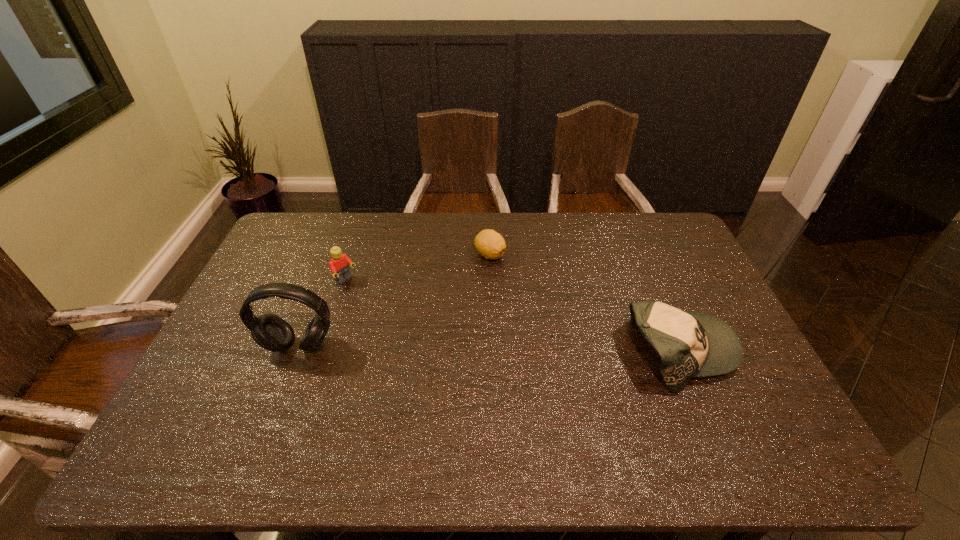
At what (x,y) coordinates should I click in order to perform the action: click on free space that is in between the headset and the rightmost object. Please return your answer as a coordinate pair (x, y). Looking at the image, I should click on click(490, 349).

Find the location of a particular element. This screenshot has width=960, height=540. vacant region between the Lego and the third object from left to right is located at coordinates coord(418,268).

You are a GUI agent. You are given a task and a screenshot of the screen. Output one action in this format:
    pyautogui.click(x=<x>, y=<y>)
    Task: Click on the vacant area that lies between the baseball cap and the headset
    The width and height of the screenshot is (960, 540).
    Given the screenshot: What is the action you would take?
    pyautogui.click(x=490, y=349)

Select which object is the second closest to the baseball cap. Please provide its 2D coordinates. Your answer should be formatted as a tuple, i.e. [(x, y)], where the tuple contains the x and y coordinates of a point satisfying the conditions above.

[(271, 332)]

Choose which object is the third nearest neighbor to the headset. Please provide its 2D coordinates. Your answer should be formatted as a tuple, i.e. [(x, y)], where the tuple contains the x and y coordinates of a point satisfying the conditions above.

[(690, 344)]

The width and height of the screenshot is (960, 540). Identify the location of free region that satisfies the following two spatial constraints: 1. on the front side of the rightmost object; 2. on the front-facing side of the third object from left to right. (492, 352).

Locate an element on the screen. The image size is (960, 540). free spot that satisfies the following two spatial constraints: 1. on the front side of the second object from right to left; 2. on the front-facing side of the baseball cap is located at coordinates (492, 352).

Where is `vacant space that satisfies the following two spatial constraints: 1. on the earcups of the baseball cap; 2. on the front-facing side of the tallest object`? vacant space that satisfies the following two spatial constraints: 1. on the earcups of the baseball cap; 2. on the front-facing side of the tallest object is located at coordinates (297, 352).

This screenshot has width=960, height=540. What are the coordinates of `free space that satisfies the following two spatial constraints: 1. on the earcups of the baseball cap; 2. on the front-facing side of the headset` in the screenshot? It's located at (297, 352).

You are a GUI agent. You are given a task and a screenshot of the screen. Output one action in this format:
    pyautogui.click(x=<x>, y=<y>)
    Task: Click on the vacant space that satisfies the following two spatial constraints: 1. on the earcups of the rightmost object; 2. on the front-facing side of the headset
    This screenshot has height=540, width=960.
    Given the screenshot: What is the action you would take?
    point(297,352)